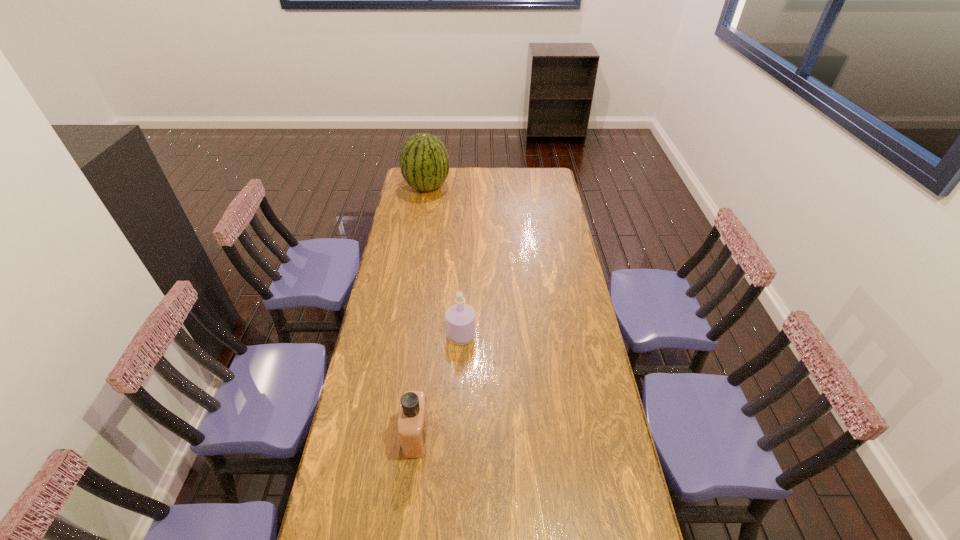
You are a GUI agent. You are given a task and a screenshot of the screen. Output one action in this format:
    pyautogui.click(x=<x>, y=<y>)
    Task: Click on the object at the left edge
    
    Given the screenshot: What is the action you would take?
    point(424,162)

Where is `object that is at the far left corner`? This screenshot has height=540, width=960. object that is at the far left corner is located at coordinates (424, 162).

This screenshot has width=960, height=540. Identify the location of vacant region at the far edge of the desktop. (476, 170).

Locate an element on the screen. This screenshot has height=540, width=960. vacant region at the left edge of the desktop is located at coordinates (357, 454).

This screenshot has width=960, height=540. In order to click on vacant space at the right edge in this screenshot , I will do `click(584, 306)`.

The width and height of the screenshot is (960, 540). I want to click on blank region between the rightmost object and the left perfume, so click(439, 386).

The height and width of the screenshot is (540, 960). I want to click on free space between the tallest object and the nearer perfume, so click(x=421, y=311).

Find the location of a particular element. unoccupied position between the nearest object and the second nearest object is located at coordinates pos(439,386).

Where is `free space between the left perfume and the watermelon`? free space between the left perfume and the watermelon is located at coordinates (421, 311).

This screenshot has width=960, height=540. I want to click on empty space that is in between the nearest object and the rightmost object, so click(x=439, y=386).